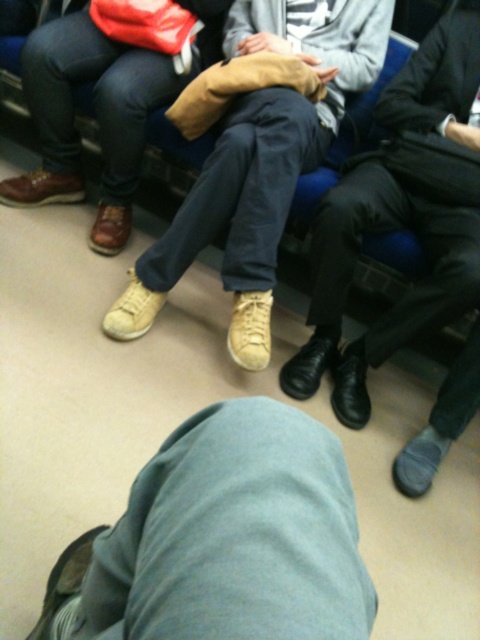
Between leather sneakers at center and tan suede shoes at center, which one appears on the right side from the viewer's perspective?

Positioned to the right is leather sneakers at center.

Locate an element on the screen. This screenshot has height=640, width=480. leather sneakers at center is located at coordinates (259, 163).

Is point (131, 321) positioned in front of point (219, 54)?

That is True.

Locate an element on the screen. leather sneakers at center is located at coordinates (259, 163).

At what (x,y) coordinates should I click in order to perform the action: click on leather shoes at center. Please return your answer as a coordinate pair (x, y). Looking at the image, I should click on (400, 216).

Does point (398, 336) come behind point (345, 76)?

No, it is in front of (345, 76).

Where is `leather shoes at center`? The height and width of the screenshot is (640, 480). leather shoes at center is located at coordinates (400, 216).

Is gray fabric pants at lower center to the left of leather sneakers at center from the viewer's perspective?

Indeed, gray fabric pants at lower center is positioned on the left side of leather sneakers at center.

Based on the photo, is gray fabric pants at lower center bigger than leather sneakers at center?

No.

The width and height of the screenshot is (480, 640). What do you see at coordinates (224, 540) in the screenshot?
I see `gray fabric pants at lower center` at bounding box center [224, 540].

Identify the location of gray fabric pants at lower center. The image size is (480, 640). (224, 540).